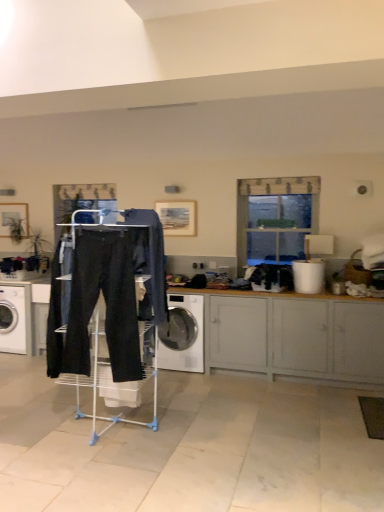
Question: Can we say black cotton sweat pants at center lies outside matte gray cabinet at lower right?

Choices:
 (A) no
 (B) yes

Answer: (B)

Question: Considering the relative sizes of black cotton sweat pants at center and matte gray cabinet at lower right in the image provided, is black cotton sweat pants at center thinner than matte gray cabinet at lower right?

Choices:
 (A) no
 (B) yes

Answer: (B)

Question: Can you confirm if black cotton sweat pants at center is bigger than matte gray cabinet at lower right?

Choices:
 (A) yes
 (B) no

Answer: (B)

Question: Is black cotton sweat pants at center looking in the opposite direction of matte gray cabinet at lower right?

Choices:
 (A) yes
 (B) no

Answer: (B)

Question: From the image's perspective, does black cotton sweat pants at center appear lower than matte gray cabinet at lower right?

Choices:
 (A) no
 (B) yes

Answer: (A)

Question: Relative to matte black pants at center, is dark blue denim jeans at center in front or behind?

Choices:
 (A) front
 (B) behind

Answer: (B)

Question: From a real-world perspective, is dark blue denim jeans at center positioned above or below matte black pants at center?

Choices:
 (A) above
 (B) below

Answer: (A)

Question: Is dark blue denim jeans at center situated inside matte black pants at center or outside?

Choices:
 (A) inside
 (B) outside

Answer: (A)

Question: Does point (150, 262) appear closer or farther from the camera than point (72, 313)?

Choices:
 (A) farther
 (B) closer

Answer: (A)

Question: Is matte black pants at center in front of or behind white glossy washing machine at left, acting as the 2th washing machine starting from the right, in the image?

Choices:
 (A) front
 (B) behind

Answer: (A)

Question: Considering the positions of matte black pants at center and white glossy washing machine at left, the 1th washing machine viewed from the left, in the image, is matte black pants at center taller or shorter than white glossy washing machine at left, the 1th washing machine viewed from the left,?

Choices:
 (A) tall
 (B) short

Answer: (A)

Question: From a real-world perspective, is matte black pants at center above or below white glossy washing machine at left, the 1th washing machine viewed from the left?

Choices:
 (A) above
 (B) below

Answer: (A)

Question: From the image's perspective, is matte black pants at center above or below white glossy washing machine at left, acting as the 2th washing machine starting from the right?

Choices:
 (A) below
 (B) above

Answer: (B)

Question: Considering the positions of clear glass window at upper center and white glossy washing machine at left, acting as the 2th washing machine starting from the right, in the image, is clear glass window at upper center wider or thinner than white glossy washing machine at left, acting as the 2th washing machine starting from the right,?

Choices:
 (A) thin
 (B) wide

Answer: (A)

Question: Is clear glass window at upper center to the left or to the right of white glossy washing machine at left, the 1th washing machine viewed from the left, in the image?

Choices:
 (A) right
 (B) left

Answer: (A)